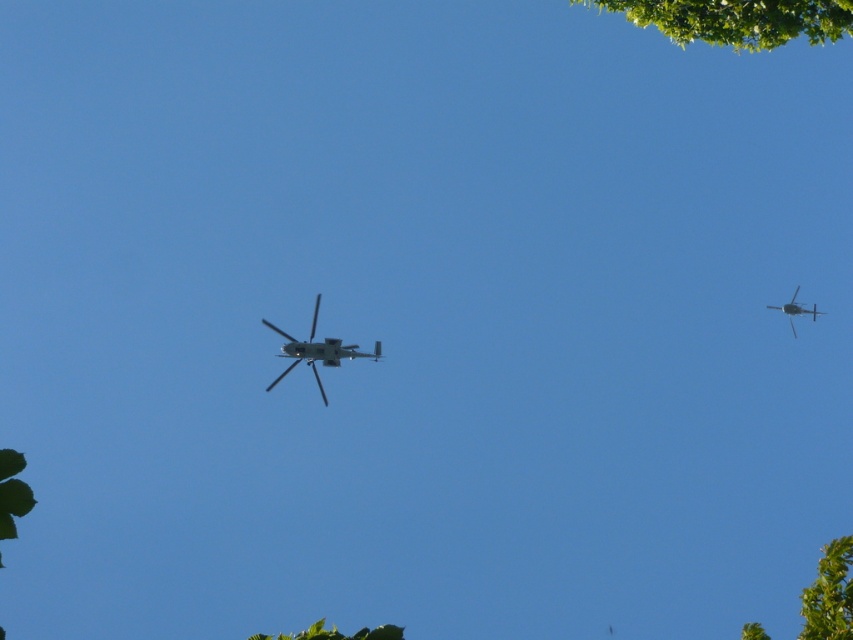
You are standing at the center of the image and looking towards the green leafy tree at lower right. Based on its position, can you determine if it is closer to you or further away compared to the helicopters?

The green leafy tree at lower right is located at point (828, 595), which places it in the lower right corner of the image. Since the helicopters are flying in the sky above the ground level where the tree is positioned, the tree is closer to you than the helicopters.

From the picture: You are a drone operator trying to navigate between the green leafy tree at lower right and the metallic gray helicopter at center. Based on their sizes, which object would appear closer to you from your ground perspective?

The green leafy tree at lower right is larger in size than the metallic gray helicopter at center, so it would appear closer to you from your ground perspective.